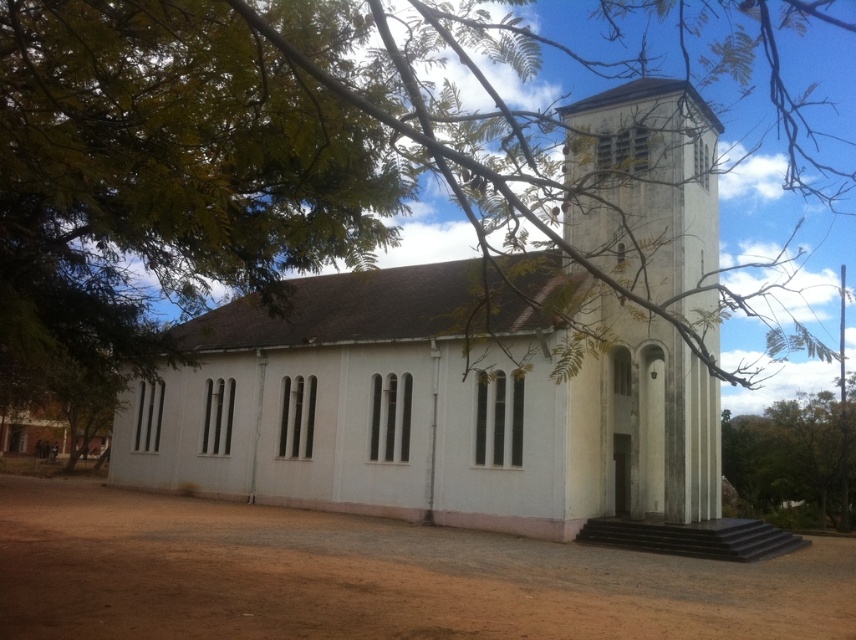
You are standing in front of the church and want to take a photo that includes both the white concrete church at center and the green leafy tree at lower right. Which object will appear larger in the photo?

The white concrete church at center is much taller than the green leafy tree at lower right, so it will appear larger in the photo.

You are standing in front of the white concrete church at center and want to take a photo of it. However, there is a green leafy tree at lower right blocking part of the view. Based on their positions, can you determine if the tree is in front of or behind the church?

The white concrete church at center is positioned over green leafy tree at lower right, meaning the tree is behind the church and not blocking the view.